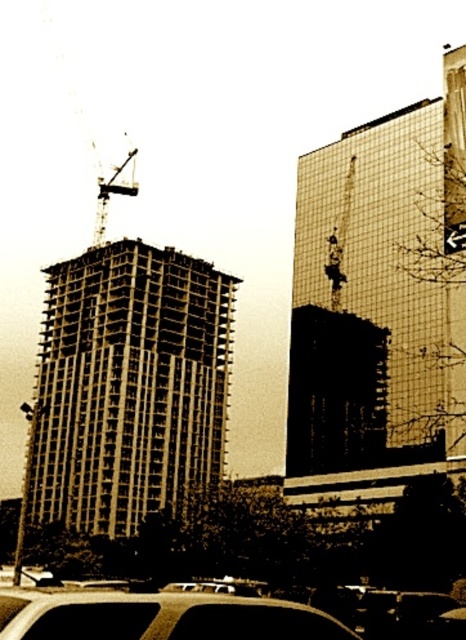
You are an inspector checking the construction site. You need to determine if the metallic construction crane at upper left can reach the top of the concrete frame building at left. Based on their heights, what is your assessment?

The concrete frame building at left is taller than the metallic construction crane at upper left, so the crane cannot reach the top of the concrete frame building at left.

You are standing at the construction site and want to know how far the concrete frame building at left is from you. Can you determine the distance based on the information provided?

The concrete frame building at left is 192.19 feet away from the viewer.